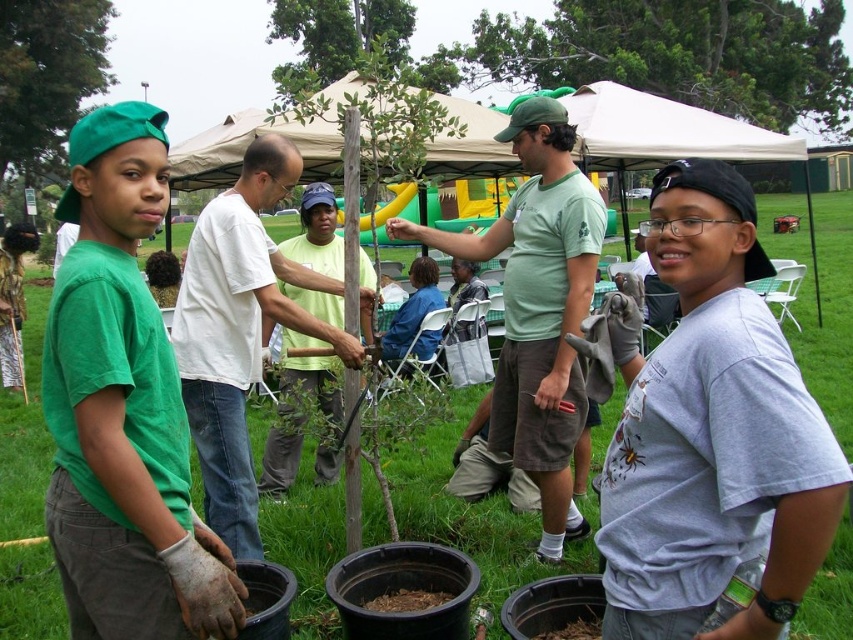
Question: Does green matte tree at upper center have a greater width compared to green cotton shirt at center?

Choices:
 (A) no
 (B) yes

Answer: (B)

Question: Which point is closer to the camera taking this photo?

Choices:
 (A) coord(386,38)
 (B) coord(62,515)

Answer: (B)

Question: Estimate the real-world distances between objects in this image. Which object is closer to the white cotton shirt at center?

Choices:
 (A) green cotton shirt at center
 (B) green leafy tree at upper center

Answer: (A)

Question: Does green matte tree at upper center have a larger size compared to green leafy tree at upper center?

Choices:
 (A) no
 (B) yes

Answer: (A)

Question: Can you confirm if green matte shirt at center is wider than green matte tree at upper center?

Choices:
 (A) yes
 (B) no

Answer: (B)

Question: Which object is farther from the camera taking this photo?

Choices:
 (A) green cotton shirt at center
 (B) white cotton shirt at center
 (C) green leafy tree at upper center

Answer: (C)